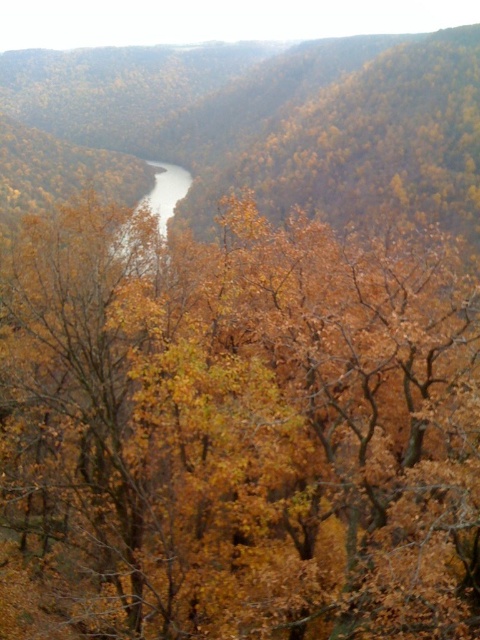
You are standing in the valley and want to take a photo of the yellow leafy tree at center and the gray smooth water at center. Which object is wider in the image?

The yellow leafy tree at center might be wider than gray smooth water at center.

You are standing in the valley and want to take a photo that includes both the yellow leafy tree at center and the gray smooth water at center. Based on their positions, which object will appear larger in the photo?

The yellow leafy tree at center will appear larger in the photo because it is closer to the viewer than the gray smooth water at center.